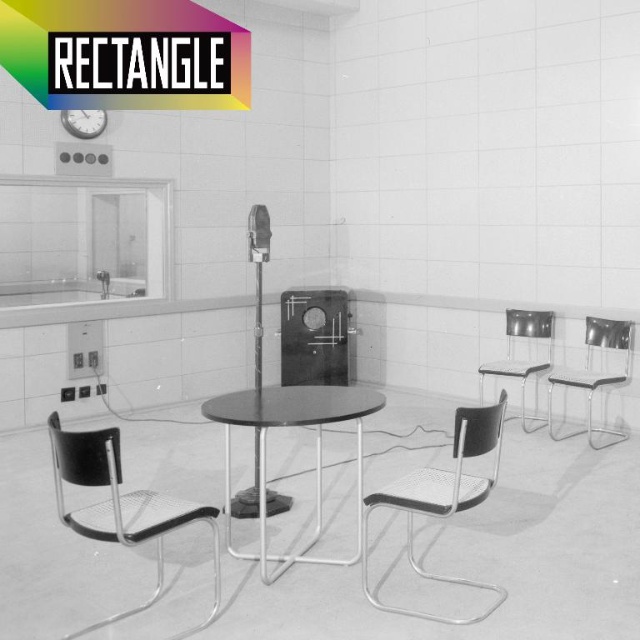
Can you confirm if metallic black table at center is bigger than clear plastic chair at right?

Correct, metallic black table at center is larger in size than clear plastic chair at right.

Does metallic black table at center have a smaller size compared to clear plastic chair at right?

No, metallic black table at center is not smaller than clear plastic chair at right.

Does point (225, 486) come farther from viewer compared to point (586, 330)?

No, it is not.

Where is `metallic black table at center`? metallic black table at center is located at coordinates (291, 426).

Can you confirm if metallic mesh swivel chair at center is thinner than metallic clock at upper left?

No.

Is point (413, 502) positioned behind point (102, 125)?

No, it is in front of (102, 125).

Identify the location of metallic mesh swivel chair at center. (444, 497).

Which is more to the left, metallic black table at center or metallic mesh swivel chair at center?

metallic black table at center

Which is above, metallic black table at center or metallic mesh swivel chair at center?

Positioned higher is metallic black table at center.

Image resolution: width=640 pixels, height=640 pixels. I want to click on metallic black table at center, so click(291, 426).